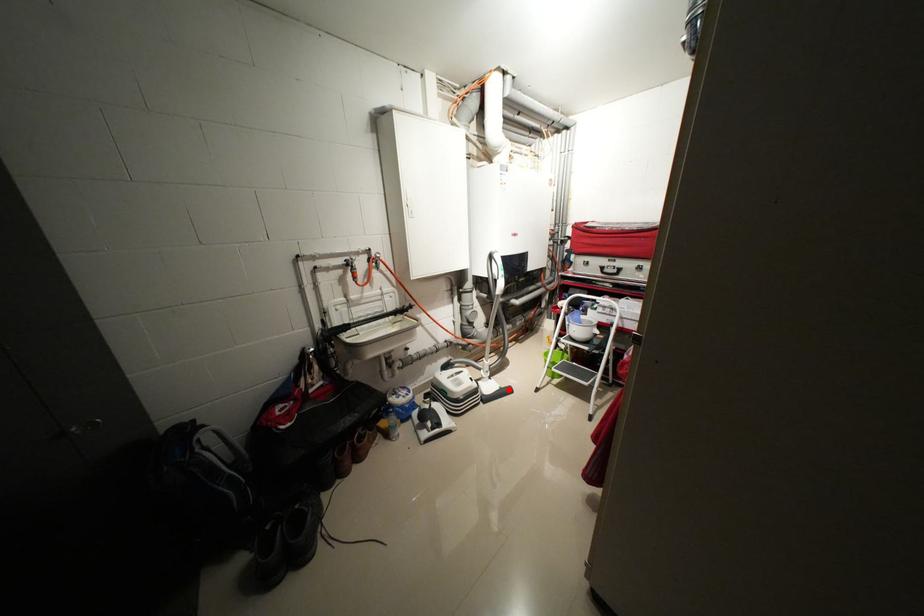
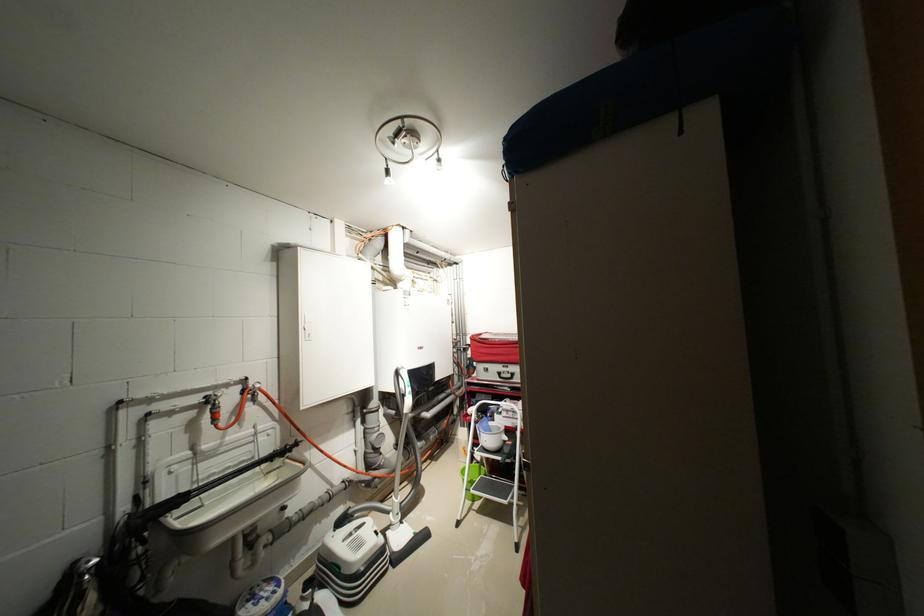
Question: I am providing you with two images of the same scene from different viewpoints. In image1, a red point is highlighted. Considering the same 3D point in image2, which of the following is correct?

Choices:
 (A) It is closer
 (B) It is farther

Answer: (A)